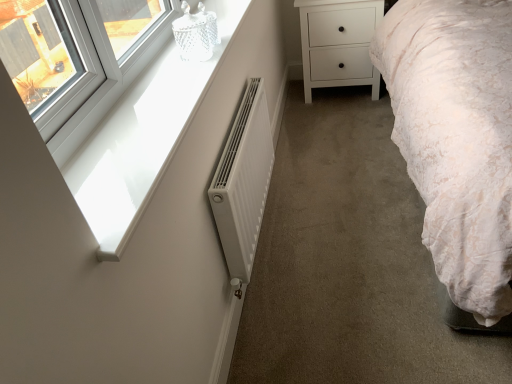
Question: Considering the relative sizes of white matte radiator at center and white matte chest of drawers at center in the image provided, is white matte radiator at center smaller than white matte chest of drawers at center?

Choices:
 (A) no
 (B) yes

Answer: (B)

Question: Can you confirm if white matte radiator at center is thinner than white matte chest of drawers at center?

Choices:
 (A) no
 (B) yes

Answer: (B)

Question: Is white matte radiator at center positioned in front of white matte chest of drawers at center?

Choices:
 (A) yes
 (B) no

Answer: (A)

Question: Does white matte radiator at center have a larger size compared to white matte chest of drawers at center?

Choices:
 (A) yes
 (B) no

Answer: (B)

Question: From a real-world perspective, is white matte radiator at center physically above white matte chest of drawers at center?

Choices:
 (A) yes
 (B) no

Answer: (A)

Question: Would you say white glossy window sill at upper left is inside or outside white glossy window sill at upper left?

Choices:
 (A) outside
 (B) inside

Answer: (A)

Question: Considering the positions of white glossy window sill at upper left and white glossy window sill at upper left in the image, is white glossy window sill at upper left wider or thinner than white glossy window sill at upper left?

Choices:
 (A) thin
 (B) wide

Answer: (B)

Question: From the image's perspective, relative to white glossy window sill at upper left, is white glossy window sill at upper left above or below?

Choices:
 (A) above
 (B) below

Answer: (B)

Question: Would you say white glossy window sill at upper left is to the left or to the right of white glossy window sill at upper left in the picture?

Choices:
 (A) left
 (B) right

Answer: (B)

Question: In terms of size, does white glossy window sill at upper left appear bigger or smaller than white glossy window sill at upper left?

Choices:
 (A) big
 (B) small

Answer: (A)

Question: From the image's perspective, is white glossy window sill at upper left above or below white glossy window sill at upper left?

Choices:
 (A) above
 (B) below

Answer: (A)

Question: From their relative heights in the image, would you say white glossy window sill at upper left is taller or shorter than white glossy window sill at upper left?

Choices:
 (A) short
 (B) tall

Answer: (B)

Question: In the image, is white glossy window sill at upper left on the left side or the right side of white glossy window sill at upper left?

Choices:
 (A) left
 (B) right

Answer: (A)

Question: In the image, is white matte radiator at center on the left side or the right side of white glossy window sill at upper left?

Choices:
 (A) left
 (B) right

Answer: (B)

Question: Does point tap(266, 112) appear closer or farther from the camera than point tap(142, 145)?

Choices:
 (A) farther
 (B) closer

Answer: (A)